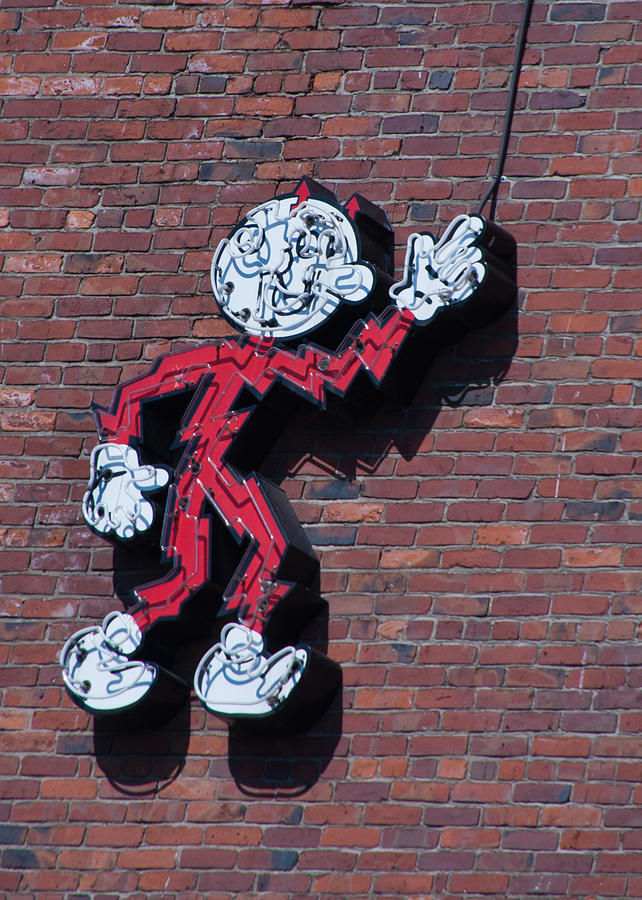
The height and width of the screenshot is (900, 642). I want to click on shadow on wall, so click(x=494, y=339).